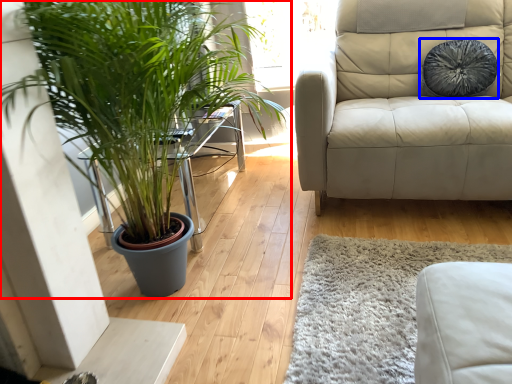
Question: Which point is closer to the camera, houseplant (highlighted by a red box) or pillow (highlighted by a blue box)?

Choices:
 (A) houseplant
 (B) pillow

Answer: (A)